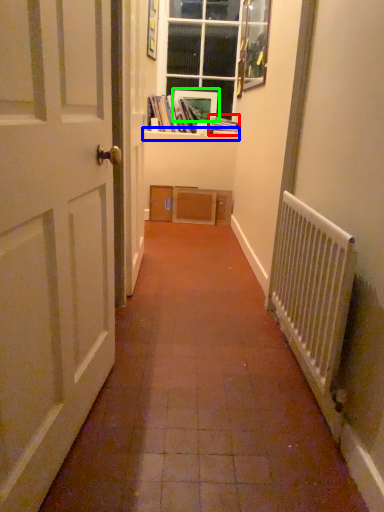
Question: Which object is positioned closest to book (highlighted by a red box)? Select from window sill (highlighted by a blue box) and picture frame (highlighted by a green box).

Choices:
 (A) window sill
 (B) picture frame

Answer: (A)